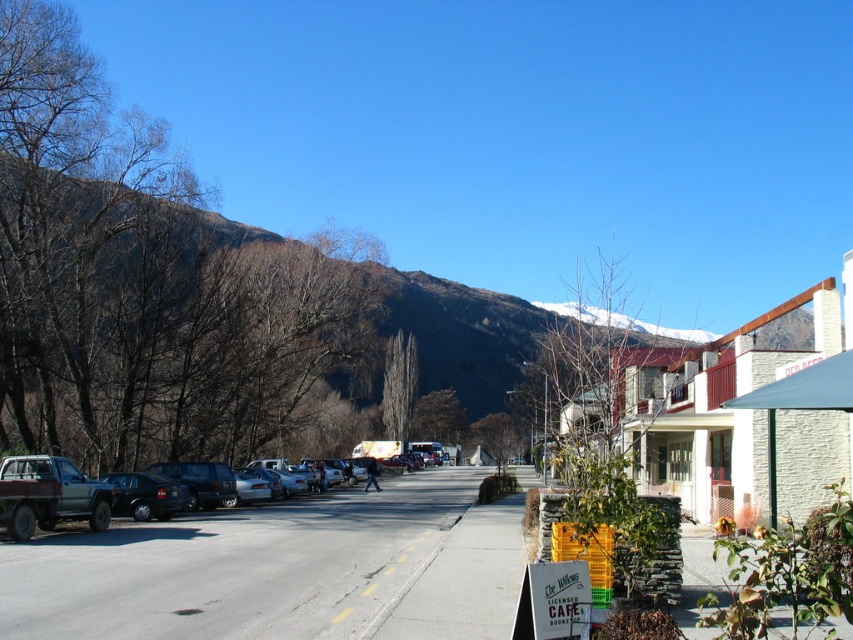
Question: Which point appears farthest from the camera in this image?

Choices:
 (A) (265, 483)
 (B) (660, 376)
 (C) (213, 253)

Answer: (C)

Question: Does brown textured mountain at upper left appear on the left side of rustic wood pickup truck at left?

Choices:
 (A) yes
 (B) no

Answer: (B)

Question: Estimate the real-world distances between objects in this image. Which object is farther from the brown textured mountain at upper left?

Choices:
 (A) rustic wood pickup truck at left
 (B) white stone building at center

Answer: (A)

Question: Which object appears farthest from the camera in this image?

Choices:
 (A) white stone building at center
 (B) brown textured mountain at upper left
 (C) rustic wood pickup truck at left

Answer: (C)

Question: Does white stone building at center lie behind rustic wood pickup truck at left?

Choices:
 (A) yes
 (B) no

Answer: (B)

Question: Is white stone building at center behind rustic wood pickup truck at left?

Choices:
 (A) yes
 (B) no

Answer: (B)